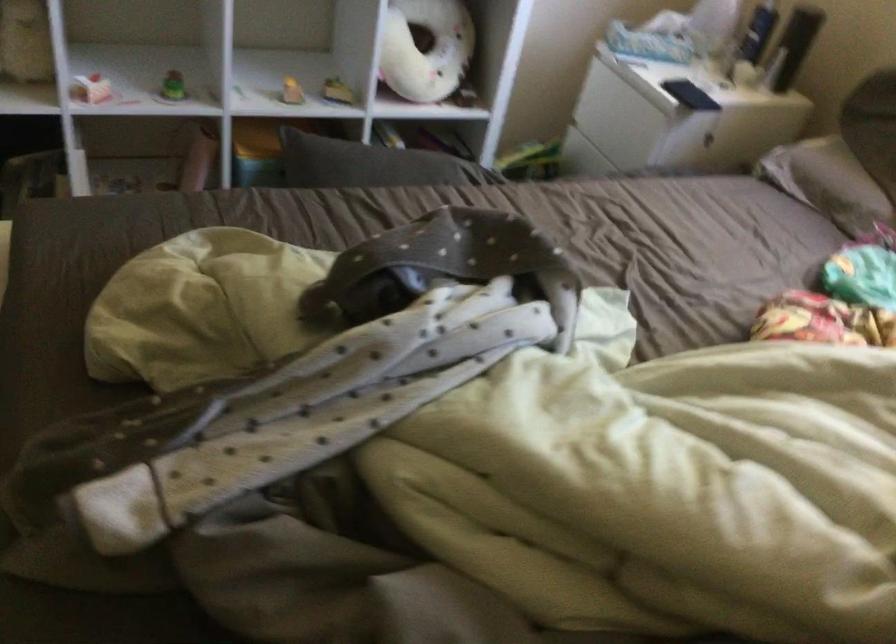
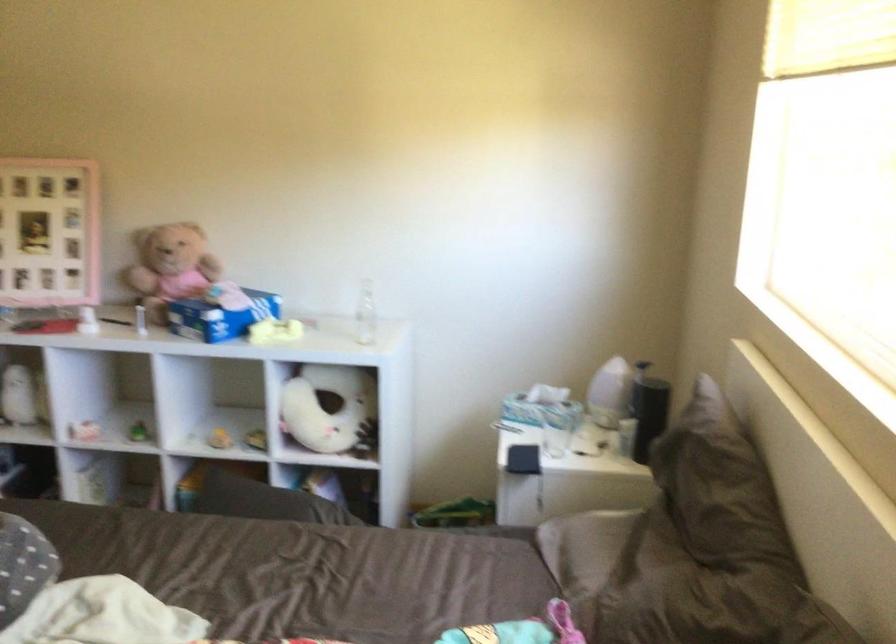
Find the pixel in the second image that matches pixel 688 84 in the first image.

(522, 459)